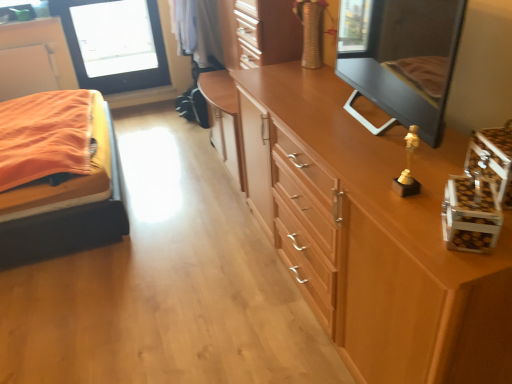
Question: Is matte black mirror at upper right at the right side of orange fabric bed at left?

Choices:
 (A) yes
 (B) no

Answer: (A)

Question: Considering the relative positions of matte black mirror at upper right and orange fabric bed at left in the image provided, is matte black mirror at upper right behind orange fabric bed at left?

Choices:
 (A) yes
 (B) no

Answer: (B)

Question: Is matte black mirror at upper right directly adjacent to orange fabric bed at left?

Choices:
 (A) no
 (B) yes

Answer: (A)

Question: Can you confirm if matte black mirror at upper right is smaller than orange fabric bed at left?

Choices:
 (A) yes
 (B) no

Answer: (A)

Question: Is the depth of matte black mirror at upper right less than that of orange fabric bed at left?

Choices:
 (A) no
 (B) yes

Answer: (B)

Question: Is matte black mirror at upper right situated inside light brown wood chest of drawers at upper right or outside?

Choices:
 (A) inside
 (B) outside

Answer: (B)

Question: In terms of height, does matte black mirror at upper right look taller or shorter compared to light brown wood chest of drawers at upper right?

Choices:
 (A) tall
 (B) short

Answer: (B)

Question: Considering their positions, is matte black mirror at upper right located in front of or behind light brown wood chest of drawers at upper right?

Choices:
 (A) behind
 (B) front

Answer: (A)

Question: Is matte black mirror at upper right bigger or smaller than light brown wood chest of drawers at upper right?

Choices:
 (A) big
 (B) small

Answer: (B)

Question: Relative to transparent glass window screen at upper left, is wooden dresser at center in front or behind?

Choices:
 (A) front
 (B) behind

Answer: (A)

Question: Considering the relative positions of wooden dresser at center and transparent glass window screen at upper left in the image provided, is wooden dresser at center to the left or to the right of transparent glass window screen at upper left?

Choices:
 (A) left
 (B) right

Answer: (B)

Question: Do you think wooden dresser at center is within transparent glass window screen at upper left, or outside of it?

Choices:
 (A) inside
 (B) outside

Answer: (B)

Question: Considering the positions of wooden dresser at center and transparent glass window screen at upper left in the image, is wooden dresser at center bigger or smaller than transparent glass window screen at upper left?

Choices:
 (A) big
 (B) small

Answer: (A)

Question: Considering their positions, is transparent glass window screen at upper left located in front of or behind wooden dresser at center?

Choices:
 (A) front
 (B) behind

Answer: (B)

Question: Is transparent glass window screen at upper left inside the boundaries of wooden dresser at center, or outside?

Choices:
 (A) inside
 (B) outside

Answer: (B)